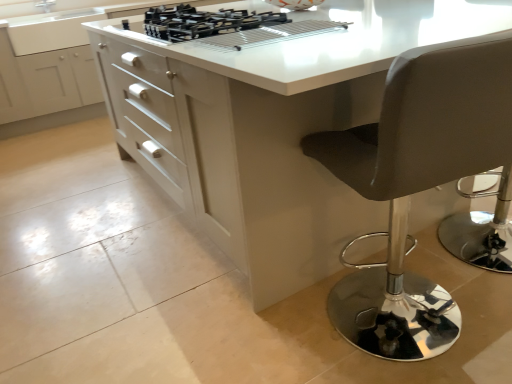
Question: From the image's perspective, is white glossy cabinet at center beneath black matte gas stove at upper center?

Choices:
 (A) yes
 (B) no

Answer: (B)

Question: Considering the relative sizes of white glossy cabinet at center and black matte gas stove at upper center in the image provided, is white glossy cabinet at center taller than black matte gas stove at upper center?

Choices:
 (A) no
 (B) yes

Answer: (B)

Question: From a real-world perspective, does white glossy cabinet at center sit lower than black matte gas stove at upper center?

Choices:
 (A) no
 (B) yes

Answer: (B)

Question: Is white glossy cabinet at center closer to camera compared to black matte gas stove at upper center?

Choices:
 (A) no
 (B) yes

Answer: (A)

Question: Would you say white glossy cabinet at center is outside black matte gas stove at upper center?

Choices:
 (A) yes
 (B) no

Answer: (A)

Question: Based on their sizes in the image, would you say black matte gas stove at upper center is bigger or smaller than leatherette stool at right?

Choices:
 (A) big
 (B) small

Answer: (B)

Question: Is point (288, 29) positioned closer to the camera than point (373, 339)?

Choices:
 (A) closer
 (B) farther

Answer: (B)

Question: From a real-world perspective, is black matte gas stove at upper center above or below leatherette stool at right?

Choices:
 (A) above
 (B) below

Answer: (A)

Question: Considering their positions, is black matte gas stove at upper center located in front of or behind leatherette stool at right?

Choices:
 (A) front
 (B) behind

Answer: (B)

Question: Visually, is white glossy table at center positioned to the left or to the right of leatherette stool at right?

Choices:
 (A) right
 (B) left

Answer: (B)

Question: Looking at the image, does white glossy table at center seem bigger or smaller compared to leatherette stool at right?

Choices:
 (A) small
 (B) big

Answer: (B)

Question: Do you think white glossy table at center is within leatherette stool at right, or outside of it?

Choices:
 (A) inside
 (B) outside

Answer: (B)

Question: Considering the positions of white glossy table at center and leatherette stool at right in the image, is white glossy table at center wider or thinner than leatherette stool at right?

Choices:
 (A) wide
 (B) thin

Answer: (A)

Question: From the image's perspective, is leatherette stool at right located above or below black matte gas stove at upper center?

Choices:
 (A) above
 (B) below

Answer: (B)

Question: Considering their positions, is leatherette stool at right located in front of or behind black matte gas stove at upper center?

Choices:
 (A) front
 (B) behind

Answer: (A)